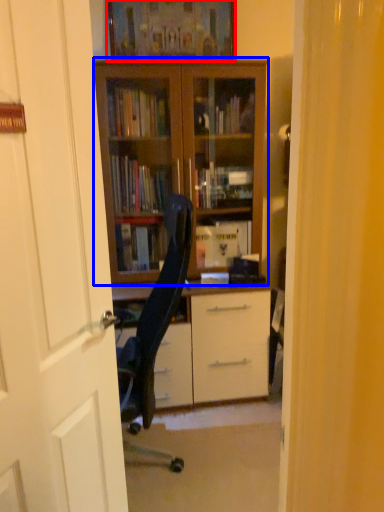
Question: Which object is further to the camera taking this photo, picture frame (highlighted by a red box) or bookcase (highlighted by a blue box)?

Choices:
 (A) picture frame
 (B) bookcase

Answer: (A)